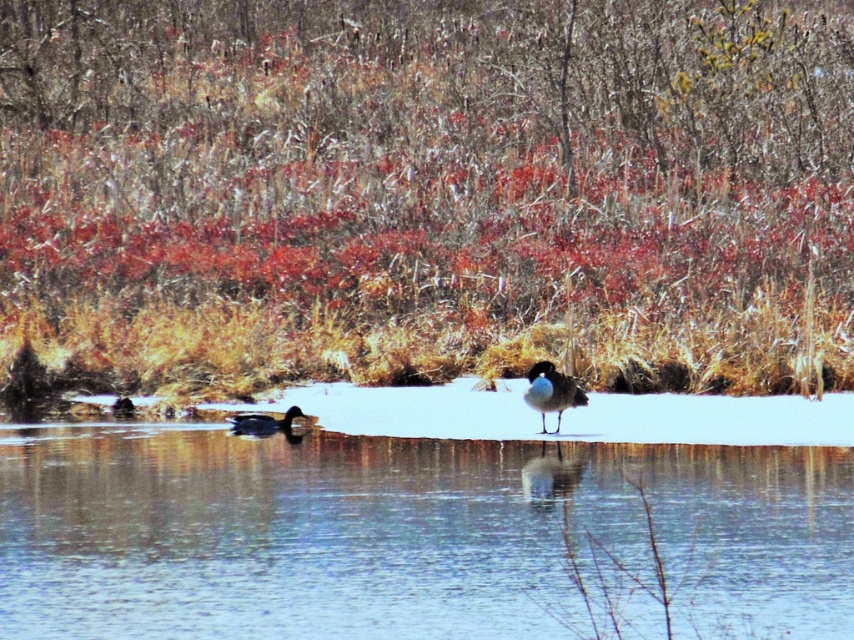
You are standing at the camera position and want to reach point [358,6]. Is the distance more than 30 meters?

Yes, the distance between the camera and point [358,6] is 32.58 meters, which is more than 30 meters.

Consider the image. You are an environmental scientist studying the pond. You observe the brown grass at center and the clear ice at center. Which object is located above the other?

The brown grass at center is positioned over clear ice at center, so the brown grass is above the ice.

From the picture: You are an ornithologist observing the two ducks in the winter scene. Which duck, the white glossy duck at center or the shiny black duck at lower left, would you estimate to have a greater body mass based on their visual size?

The white glossy duck at center has a larger size compared to the shiny black duck at lower left, so it would likely have a greater body mass.